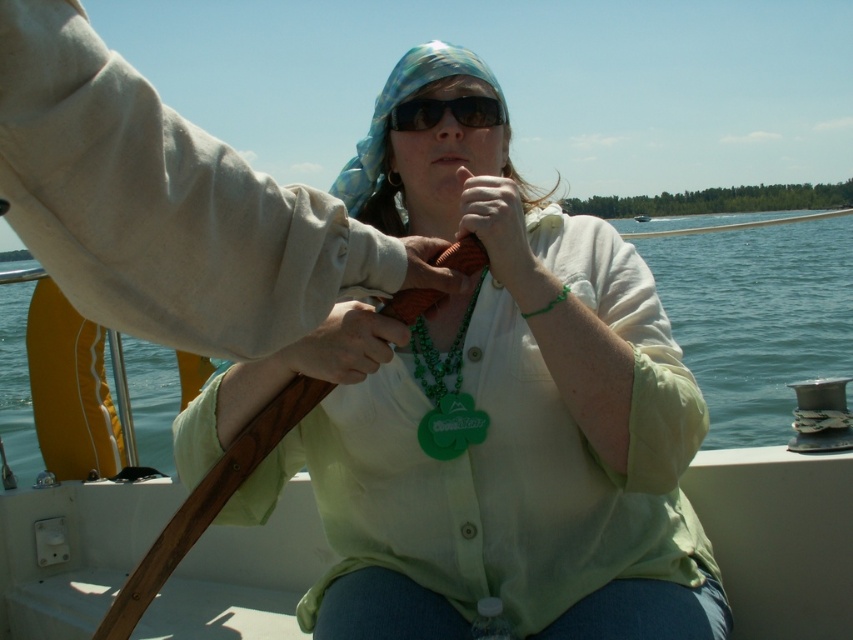
Question: Does clear blue water at center have a lesser width compared to matte green necklace at center?

Choices:
 (A) no
 (B) yes

Answer: (A)

Question: Which object is farther from the camera taking this photo?

Choices:
 (A) blue silk headscarf at center
 (B) matte green shirt at center
 (C) matte green necklace at center
 (D) clear blue water at center

Answer: (A)

Question: Where is matte green shirt at center located in relation to clear blue water at center in the image?

Choices:
 (A) right
 (B) left

Answer: (B)

Question: Observing the image, what is the correct spatial positioning of blue silk headscarf at center in reference to orange rubber band at center?

Choices:
 (A) right
 (B) left

Answer: (B)

Question: Which point is farther to the camera?

Choices:
 (A) (517, 253)
 (B) (485, 112)

Answer: (B)

Question: Which point is farther from the camera taking this photo?

Choices:
 (A) (236, 509)
 (B) (697, 285)
 (C) (437, 292)
 (D) (410, 60)

Answer: (B)